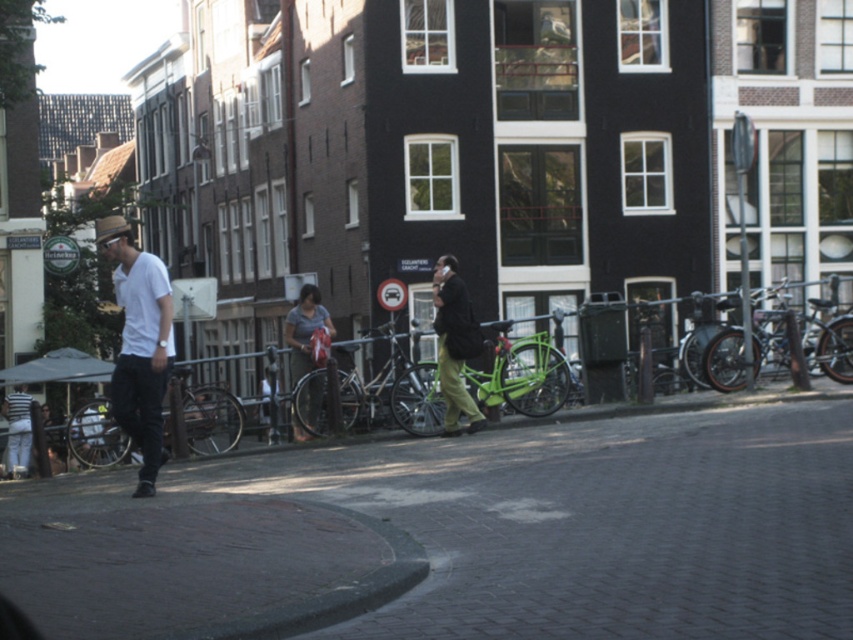
You are standing at the center of the cobblestone street in the European city scene. You notice a white matte shirt at left. If you want to approach the person wearing it, which direction should you walk? Please provide your answer in terms of left, right, forward, or backward relative to your current position facing the scene.

Since the white matte shirt at left is located at point coordinates indicating the left side of the scene, you should walk to the left to approach the person wearing it.

You are a tourist standing on the cobblestone street and want to take a photo of the white matte shirt at left and the metallic gray fence at lower left. Which object should you zoom in more on to ensure both are clearly visible in the frame?

You should zoom in more on the metallic gray fence at lower left because the white matte shirt at left is smaller in size compared to the metallic gray fence at lower left. This way, both objects will be visible and properly sized in the photo.

You are a photographer standing in the middle of the cobblestone street and want to take a photo of both the white matte shirt at left and the matte gray shirt at center. Which direction should you move to ensure both are in the frame?

You should move to the right side because the white matte shirt at left is positioned on the left side of the matte gray shirt at center, so moving right would center both in your viewfinder.